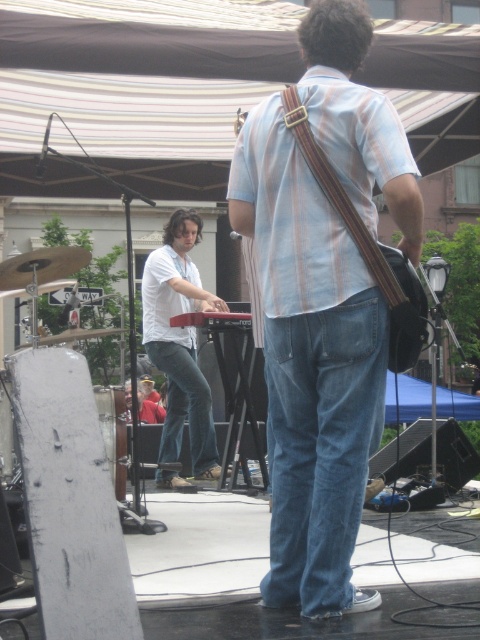
Question: In this image, where is denim jeans at center located relative to blue denim jeans at center?

Choices:
 (A) below
 (B) above

Answer: (B)

Question: Is denim jeans at center to the right of white matte keyboard at center from the viewer's perspective?

Choices:
 (A) no
 (B) yes

Answer: (B)

Question: Considering the real-world distances, which object is farthest from the denim jeans at center?

Choices:
 (A) light blue striped shirt at center
 (B) white matte keyboard at center

Answer: (B)

Question: Which point is farther to the camera?

Choices:
 (A) (342, 595)
 (B) (312, 106)

Answer: (A)

Question: Among these points, which one is farthest from the camera?

Choices:
 (A) (153, 320)
 (B) (411, 304)
 (C) (361, 352)

Answer: (A)

Question: Considering the relative positions of light blue striped shirt at center and blue denim jeans at center in the image provided, where is light blue striped shirt at center located with respect to blue denim jeans at center?

Choices:
 (A) above
 (B) below

Answer: (A)